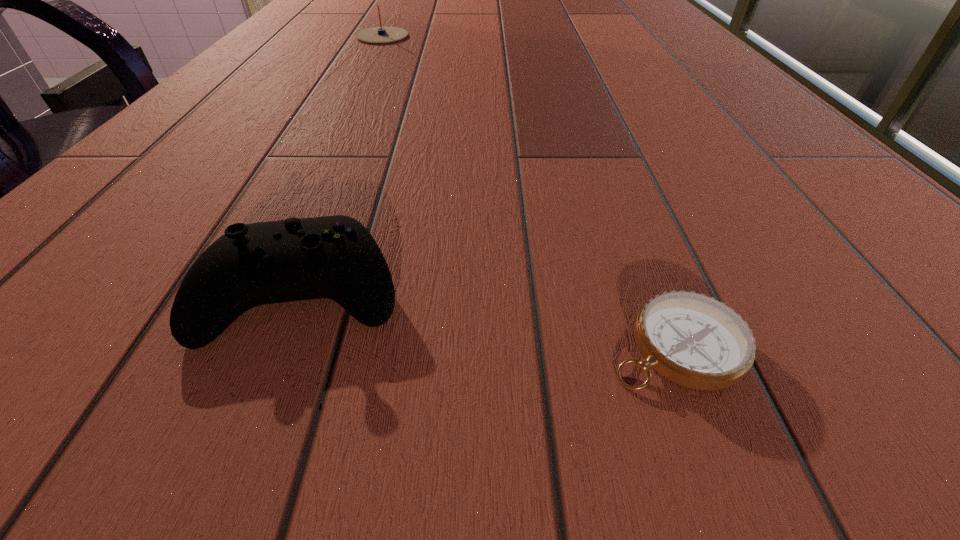
The width and height of the screenshot is (960, 540). What are the coordinates of `the taller compass` in the screenshot? It's located at (380, 34).

This screenshot has height=540, width=960. I want to click on the farther compass, so (380, 34).

Where is `control`? The height and width of the screenshot is (540, 960). control is located at coordinates (335, 257).

Identify the location of the shortest object. Image resolution: width=960 pixels, height=540 pixels. (691, 339).

I want to click on the shorter compass, so click(x=691, y=339).

Find the location of a particular element. Image resolution: width=960 pixels, height=540 pixels. free point located on the right of the farther compass is located at coordinates (578, 36).

Find the location of a particular element. free space located on the right of the control is located at coordinates (467, 291).

You are a GUI agent. You are given a task and a screenshot of the screen. Output one action in this format:
    pyautogui.click(x=<x>, y=<y>)
    Task: Click on the blank area located 0.130m on the back of the nearer compass
    The width and height of the screenshot is (960, 540).
    Given the screenshot: What is the action you would take?
    pyautogui.click(x=625, y=218)

You are a GUI agent. You are given a task and a screenshot of the screen. Output one action in this format:
    pyautogui.click(x=<x>, y=<y>)
    Task: Click on the control that is at the near edge
    This screenshot has height=540, width=960.
    Given the screenshot: What is the action you would take?
    pyautogui.click(x=335, y=257)

Find the location of a particular element. compass that is at the near edge is located at coordinates (691, 339).